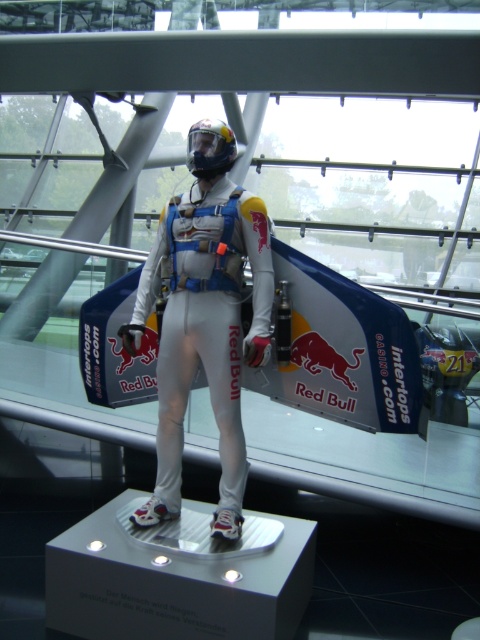
How far apart are white matte suit at center and glossy plastic helmet at center?

They are 74.79 centimeters apart.

Can you confirm if white matte suit at center is positioned to the left of glossy plastic helmet at center?

Indeed, white matte suit at center is positioned on the left side of glossy plastic helmet at center.

Is point (211, 333) positioned in front of point (195, 163)?

Yes.

Where is `white matte suit at center`? white matte suit at center is located at coordinates (204, 317).